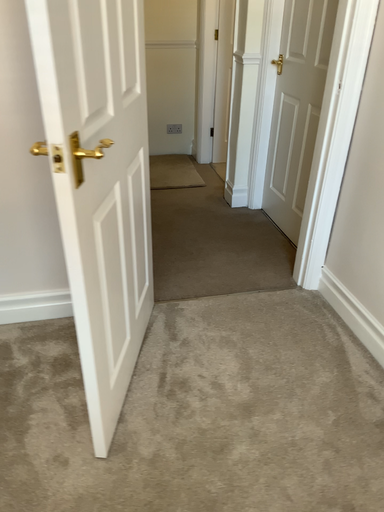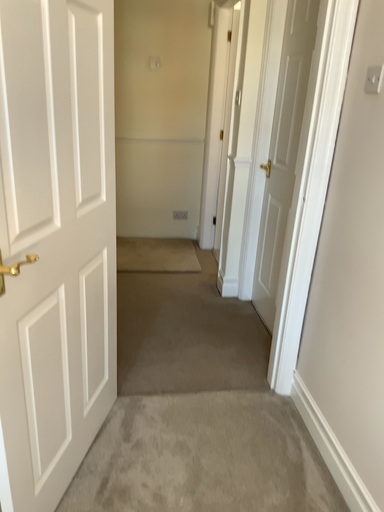
Question: How did the camera likely rotate when shooting the video?

Choices:
 (A) rotated upward
 (B) rotated downward

Answer: (A)